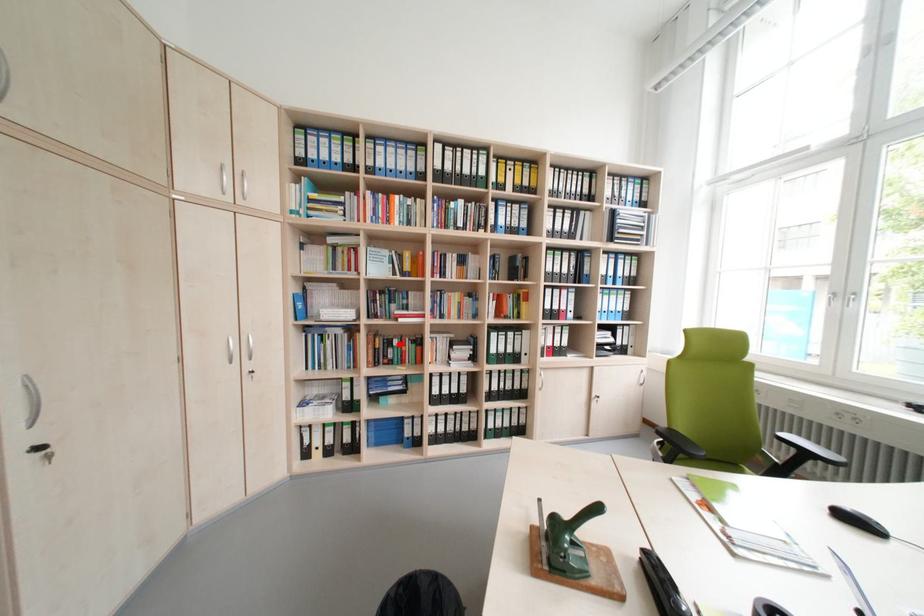
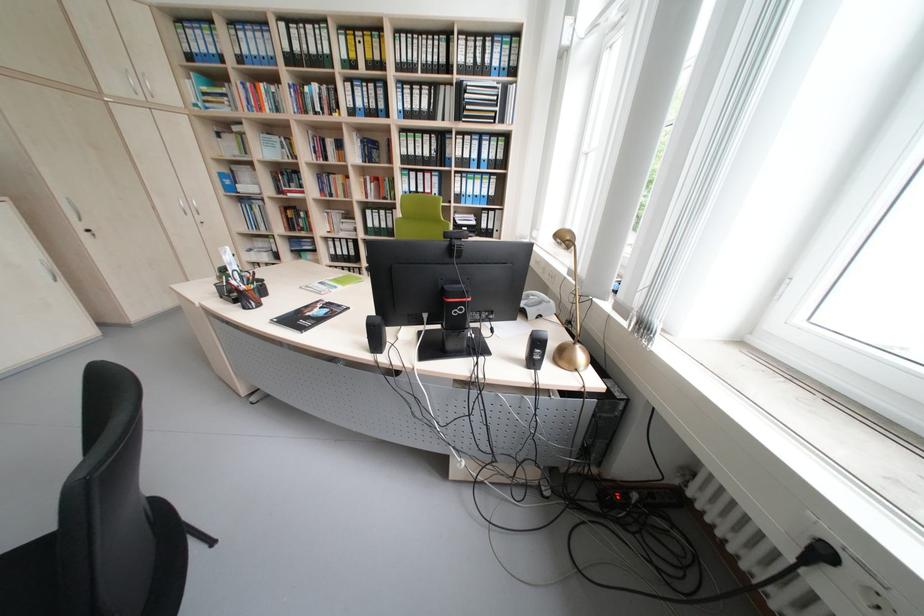
Question: I am providing you with two images of the same scene from different viewpoints. A red point is shown in image1. For the corresponding object point in image2, is it positioned nearer or farther from the camera?

Choices:
 (A) Nearer
 (B) Farther

Answer: (A)